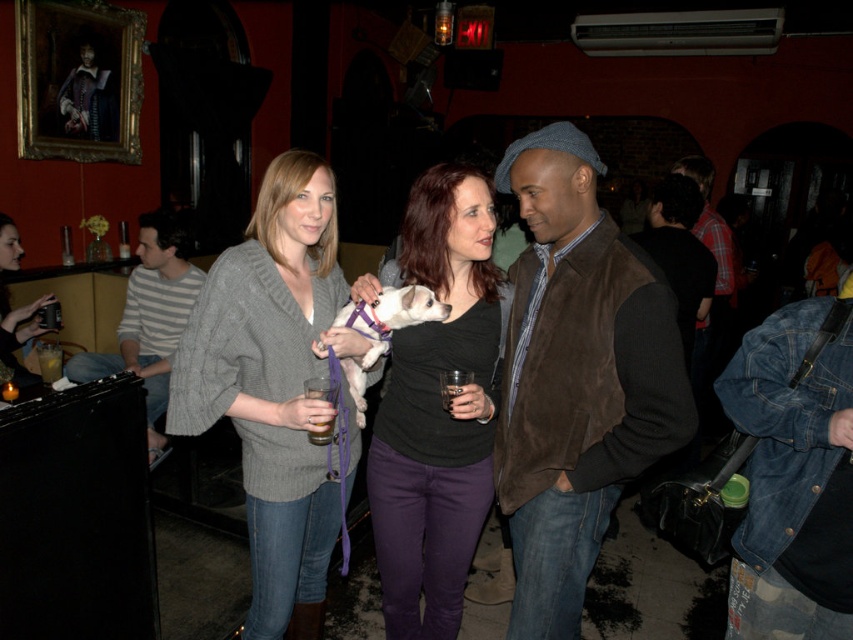
Question: Does knitted gray sweater at center appear on the right side of translucent glass at bar left?

Choices:
 (A) no
 (B) yes

Answer: (B)

Question: Among these points, which one is nearest to the camera?

Choices:
 (A) (465, 381)
 (B) (216, 284)
 (C) (10, 308)
 (D) (61, 353)

Answer: (A)

Question: Is knitted gray sweater at center to the right of translucent glass at bar left from the viewer's perspective?

Choices:
 (A) yes
 (B) no

Answer: (A)

Question: Can you confirm if translucent glass at bar left is smaller than translucent glass at center?

Choices:
 (A) no
 (B) yes

Answer: (A)

Question: Among these points, which one is farthest from the camera?

Choices:
 (A) (131, 365)
 (B) (45, 348)
 (C) (540, 352)
 (D) (3, 257)

Answer: (A)

Question: Which point appears farthest from the camera in this image?

Choices:
 (A) (42, 378)
 (B) (554, 312)

Answer: (A)